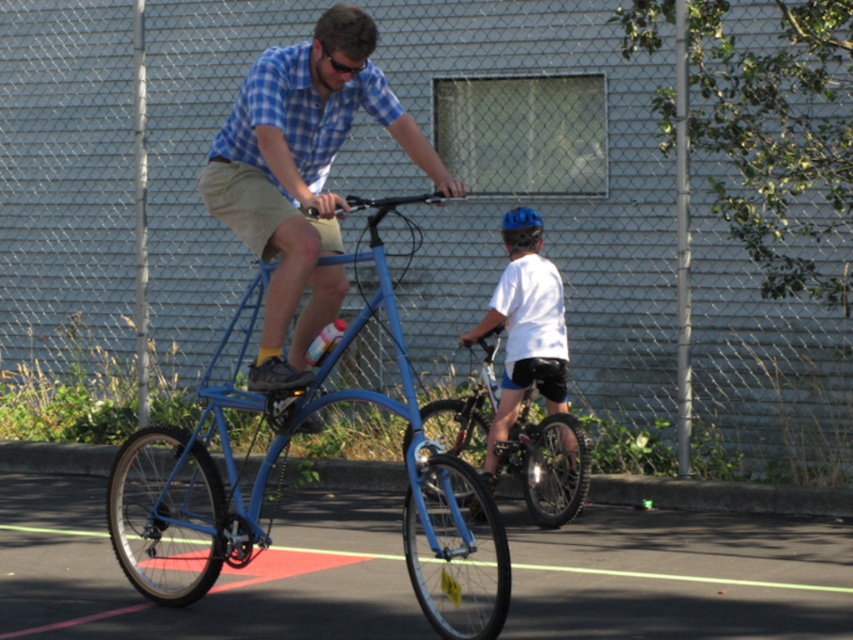
Question: Which object is the closest to the blue matte bicycle at center?

Choices:
 (A) metallic silver bicycle at center
 (B) matte blue bicycle at center
 (C) white matte shirt at center
 (D) blue matte bicycle helmet at upper center

Answer: (B)

Question: Can you confirm if matte blue bicycle at center is positioned to the left of blue matte bicycle helmet at upper center?

Choices:
 (A) no
 (B) yes

Answer: (B)

Question: Can you confirm if metallic silver bicycle at center is positioned above blue matte bicycle helmet at upper center?

Choices:
 (A) yes
 (B) no

Answer: (B)

Question: Does metallic silver bicycle at center have a larger size compared to white matte shirt at center?

Choices:
 (A) no
 (B) yes

Answer: (B)

Question: Which point is closer to the camera?

Choices:
 (A) (505, 326)
 (B) (534, 225)
 (C) (247, 76)

Answer: (C)

Question: Considering the real-world distances, which object is farthest from the blue matte bicycle helmet at upper center?

Choices:
 (A) blue matte bicycle at center
 (B) metallic silver bicycle at center
 (C) matte blue bicycle at center
 (D) white matte shirt at center

Answer: (C)